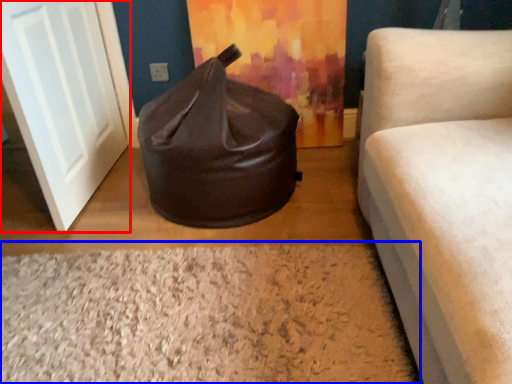
Question: Which object is closer to the camera taking this photo, door (highlighted by a red box) or granite (highlighted by a blue box)?

Choices:
 (A) door
 (B) granite

Answer: (B)